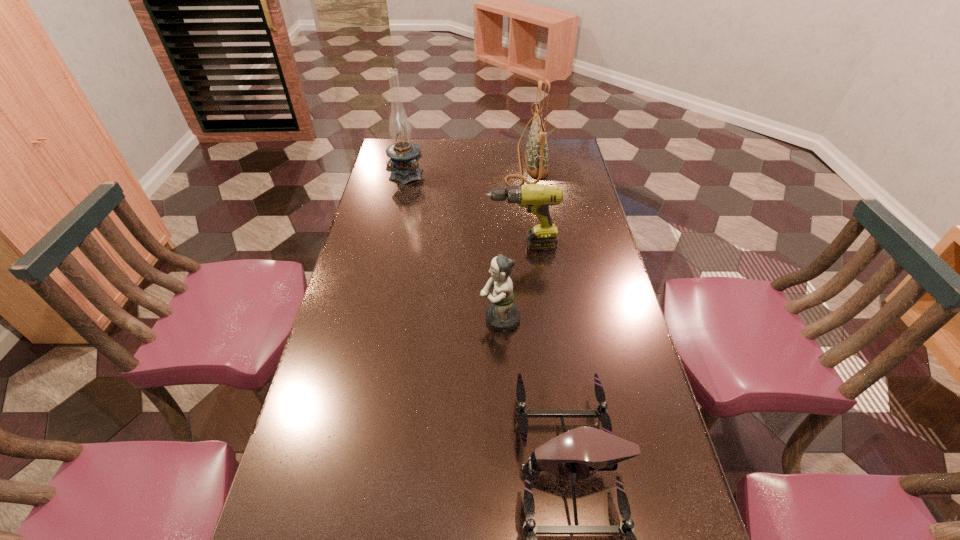
This screenshot has width=960, height=540. I want to click on unoccupied area between the fourth farthest object and the handbag, so tap(513, 241).

Identify which object is the third nearest to the tallest object. Please provide its 2D coordinates. Your answer should be formatted as a tuple, i.e. [(x, y)], where the tuple contains the x and y coordinates of a point satisfying the conditions above.

[(502, 315)]

Find the location of a particular element. Image resolution: width=960 pixels, height=540 pixels. the closest object to the figurine is located at coordinates (572, 455).